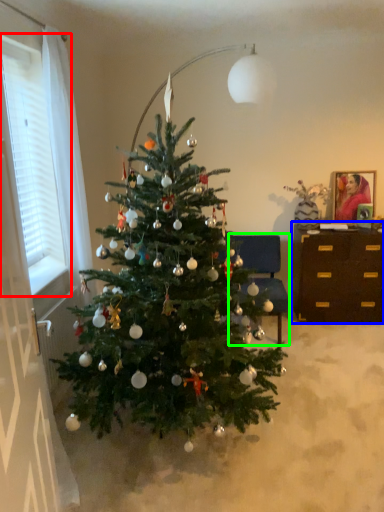
Question: Which object is the farthest from window (highlighted by a red box)? Choose among these: desk (highlighted by a blue box) or armchair (highlighted by a green box).

Choices:
 (A) desk
 (B) armchair

Answer: (A)